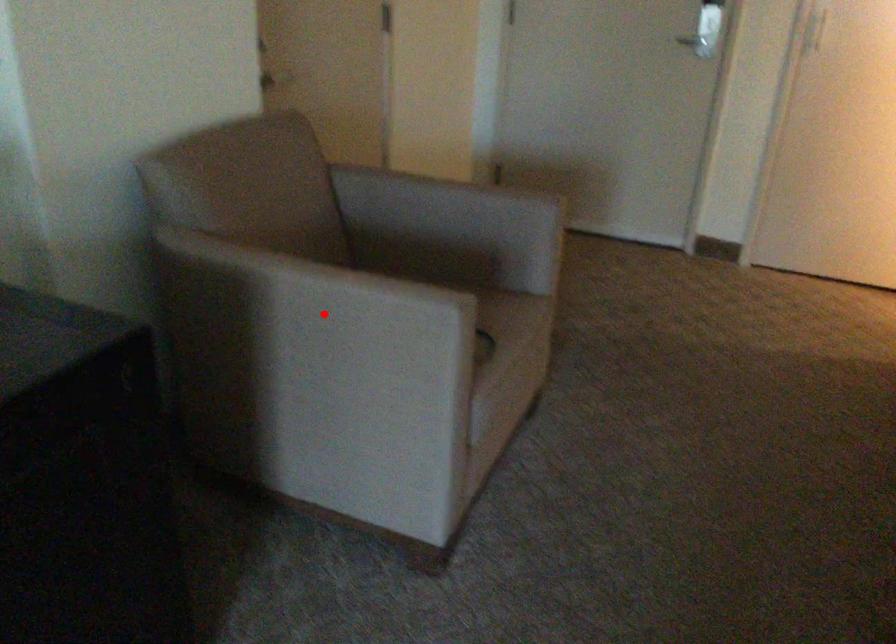
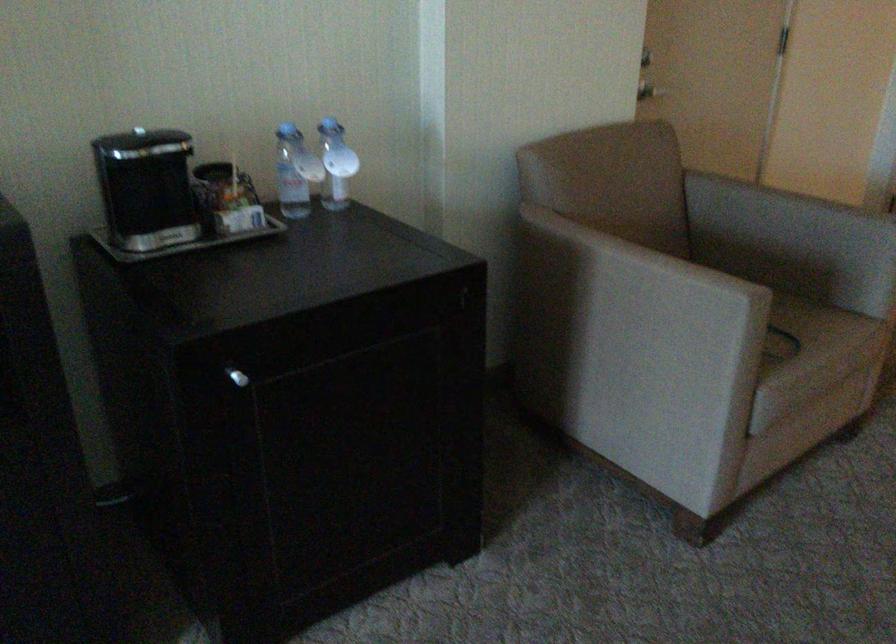
Question: I am providing you with two images of the same scene from different viewpoints. In image1, a red point is highlighted. Considering the same 3D point in image2, which of the following is correct?

Choices:
 (A) It is closer
 (B) It is farther

Answer: (B)